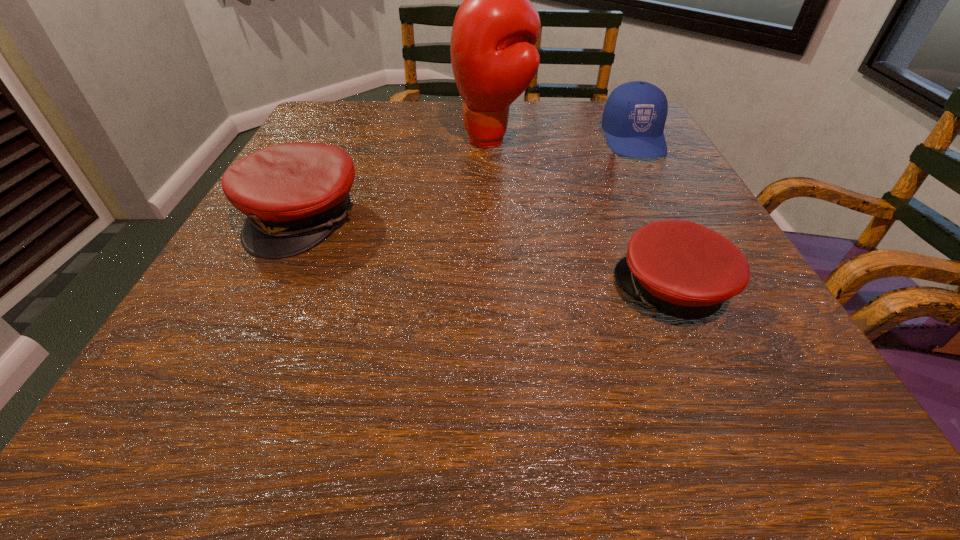
Locate an element on the screen. The height and width of the screenshot is (540, 960). the tallest object is located at coordinates (494, 60).

Where is `the second object from left to right`? Image resolution: width=960 pixels, height=540 pixels. the second object from left to right is located at coordinates (x=494, y=60).

The height and width of the screenshot is (540, 960). In order to click on the farthest cap in this screenshot , I will do `click(634, 116)`.

The height and width of the screenshot is (540, 960). Find the location of `the leftmost cap`. the leftmost cap is located at coordinates (294, 194).

You are a GUI agent. You are given a task and a screenshot of the screen. Output one action in this format:
    pyautogui.click(x=<x>, y=<y>)
    Task: Click on the shortest cap
    
    Given the screenshot: What is the action you would take?
    pyautogui.click(x=679, y=268)

Where is `vacant space located on the striking surface of the boxing glove`? vacant space located on the striking surface of the boxing glove is located at coordinates (311, 140).

Image resolution: width=960 pixels, height=540 pixels. Find the location of `free space located 0.140m on the striking surface of the boxing glove`. free space located 0.140m on the striking surface of the boxing glove is located at coordinates (396, 140).

Where is `vacant point located on the striking surface of the boxing glove`? The height and width of the screenshot is (540, 960). vacant point located on the striking surface of the boxing glove is located at coordinates (320, 140).

The width and height of the screenshot is (960, 540). What are the coordinates of `free region located on the front-facing side of the farthest cap` in the screenshot? It's located at (684, 233).

You are a GUI agent. You are given a task and a screenshot of the screen. Output one action in this format:
    pyautogui.click(x=<x>, y=<y>)
    Task: Click on the free space located 0.190m on the front of the leftmost object with an emblem
    
    Given the screenshot: What is the action you would take?
    pyautogui.click(x=240, y=352)